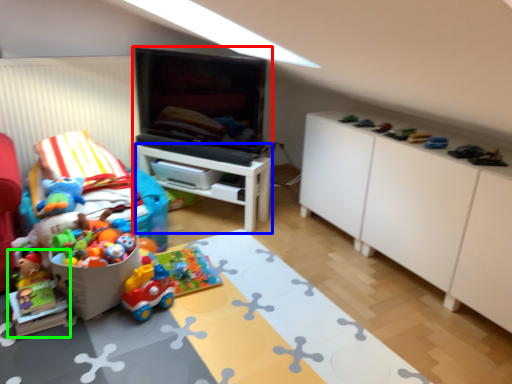
Question: Considering the real-world distances, which object is closest to entertainment center (highlighted by a red box)? table (highlighted by a blue box) or toy (highlighted by a green box).

Choices:
 (A) table
 (B) toy

Answer: (A)